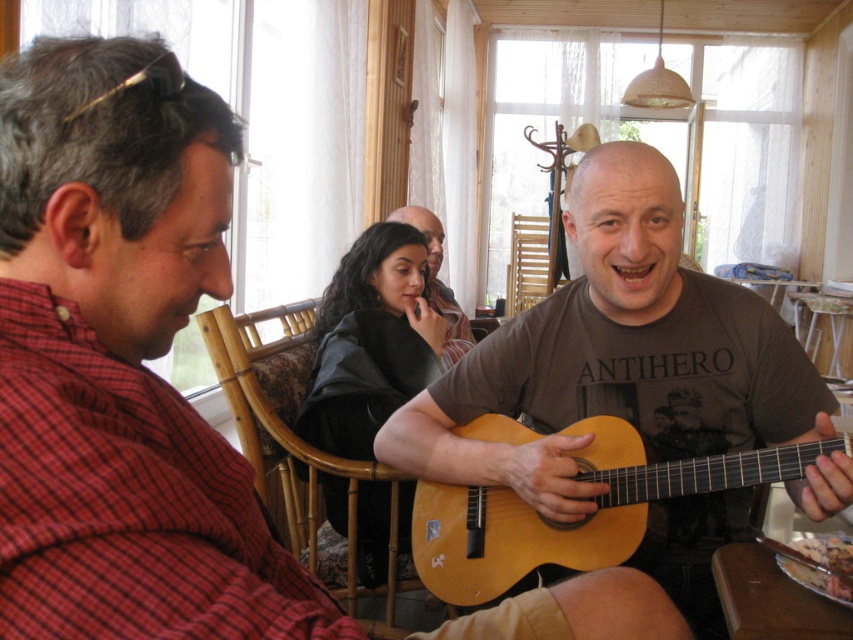
Question: Where is matte brown guitar at center located in relation to light brown wooden guitar at center in the image?

Choices:
 (A) left
 (B) right

Answer: (A)

Question: Does matte brown guitar at center appear under light brown wooden guitar at center?

Choices:
 (A) yes
 (B) no

Answer: (B)

Question: Which point appears closest to the camera in this image?

Choices:
 (A) (790, 470)
 (B) (714, 349)

Answer: (A)

Question: Observing the image, what is the correct spatial positioning of matte brown guitar at center in reference to light brown wooden guitar at center?

Choices:
 (A) left
 (B) right

Answer: (A)